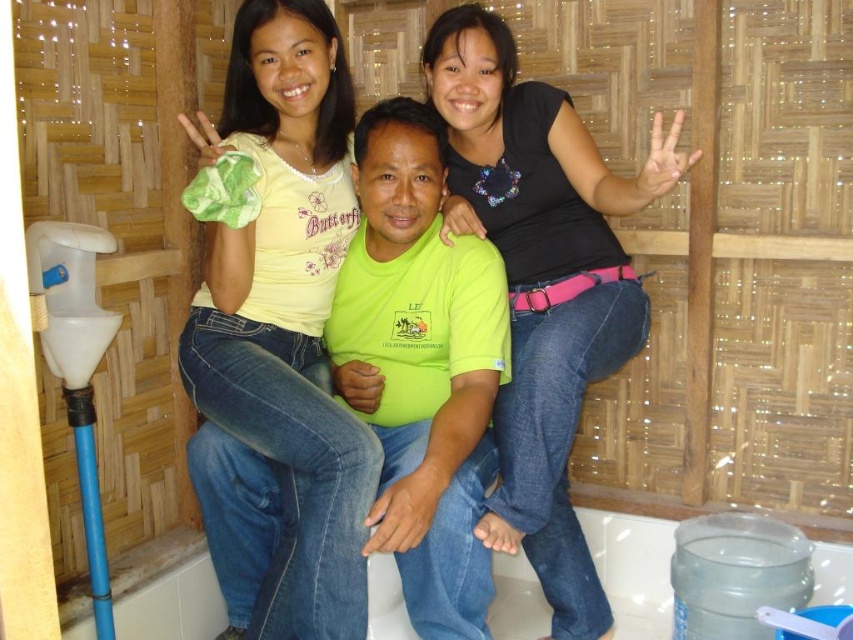
You are designing a layout for a magazine article that needs to feature both the matte yellow shirt at upper left and the black matte shirt at center. The editor wants to know which shirt takes up more visual space in the image. Based on the scene, which one should you highlight as larger?

The black matte shirt at center occupies more space than the matte yellow shirt at upper left, so it should be highlighted as the larger one in the layout.

You are standing in the bathroom and want to reach both points. Which point, point (318, 602) or point (527, 429), is closer to you?

Point (318, 602) is closer to the viewer than point (527, 429).

You are designing a layout for a photo album page that includes the matte yellow shirt at upper left and the black matte shirt at center. Since the photo album has limited vertical space, which shirt should you place higher to ensure both fit without overlapping?

The matte yellow shirt at upper left is taller than the black matte shirt at center, so placing the matte yellow shirt at upper left higher would allow both to fit within the limited vertical space without overlapping.